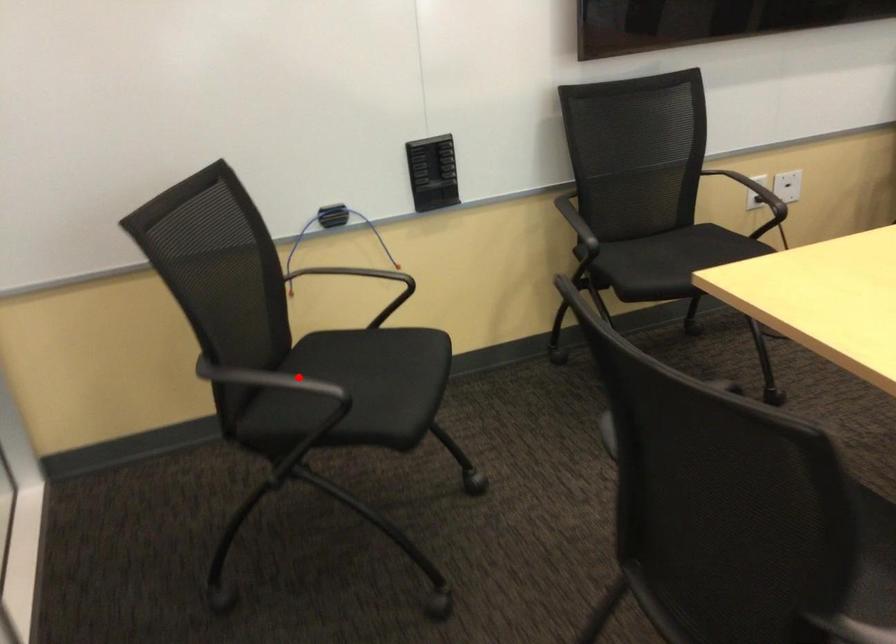
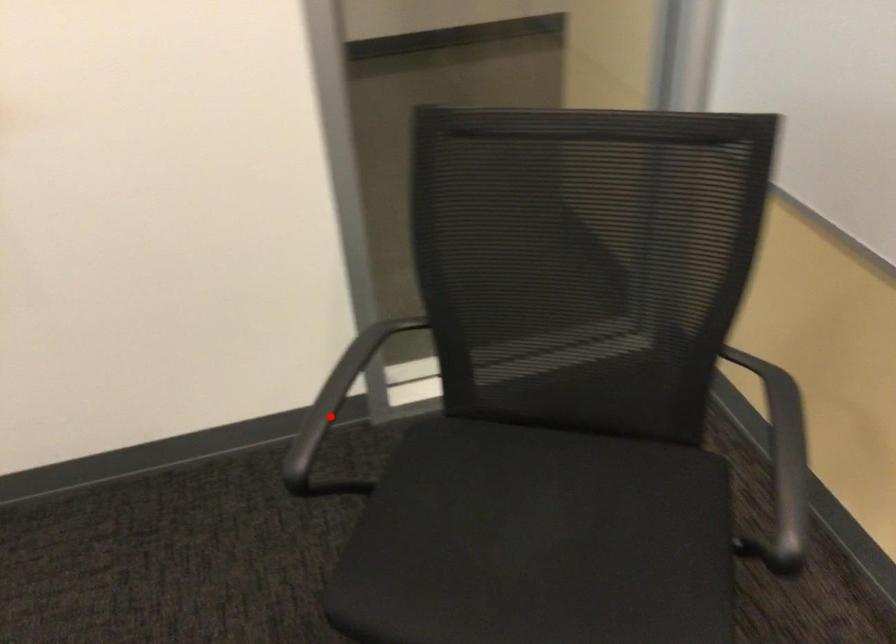
From the picture: I am providing you with two images of the same scene from different viewpoints. A red point is marked on the first image and another point is marked on the second image. Is the marked point in image1 the same physical position as the marked point in image2?

Yes